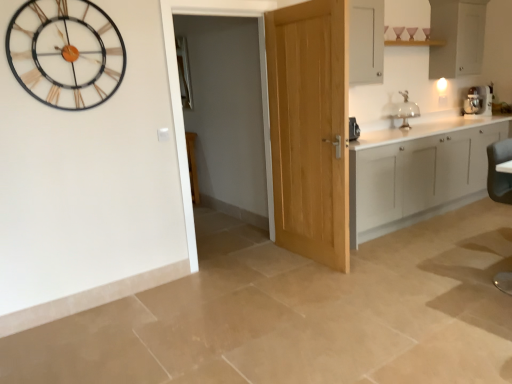
Question: Looking at their shapes, would you say white matte cabinet at upper right, which ranks as the 2th cabinetry in bottom-to-top order, is wider or thinner than black leather swivel chair at lower right?

Choices:
 (A) wide
 (B) thin

Answer: (A)

Question: From a real-world perspective, is white matte cabinet at upper right, which ranks as the first cabinetry in top-to-bottom order, physically located above or below black leather swivel chair at lower right?

Choices:
 (A) below
 (B) above

Answer: (B)

Question: Which object is positioned closest to the white matte cabinetry at right, the 1th cabinetry ordered from the bottom?

Choices:
 (A) black leather swivel chair at lower right
 (B) metallic gold and black wall clock at upper left
 (C) light oak door at center
 (D) white matte cabinet at upper right, which ranks as the first cabinetry in top-to-bottom order
 (E) clear glass cake stand at upper right

Answer: (E)

Question: Estimate the real-world distances between objects in this image. Which object is closer to the metallic gold and black wall clock at upper left?

Choices:
 (A) white matte cabinet at upper right, which ranks as the 2th cabinetry in bottom-to-top order
 (B) light oak door at center
 (C) white plastic coffee machine at upper right
 (D) clear glass cake stand at upper right
 (E) black leather swivel chair at lower right

Answer: (B)